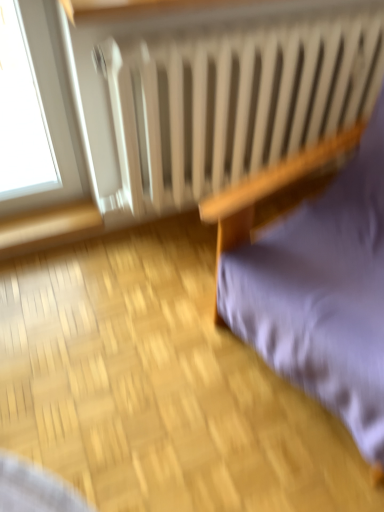
Question: From their relative heights in the image, would you say white matte radiator at upper center is taller or shorter than purple fabric cushion at right?

Choices:
 (A) tall
 (B) short

Answer: (A)

Question: In the image, is white matte radiator at upper center on the left side or the right side of purple fabric cushion at right?

Choices:
 (A) right
 (B) left

Answer: (B)

Question: From the image's perspective, is white matte radiator at upper center above or below purple fabric cushion at right?

Choices:
 (A) above
 (B) below

Answer: (A)

Question: In terms of size, does purple fabric cushion at right appear bigger or smaller than white matte radiator at upper center?

Choices:
 (A) small
 (B) big

Answer: (B)

Question: Considering the positions of purple fabric cushion at right and white matte radiator at upper center in the image, is purple fabric cushion at right taller or shorter than white matte radiator at upper center?

Choices:
 (A) tall
 (B) short

Answer: (B)

Question: Is point (370, 359) positioned closer to the camera than point (382, 6)?

Choices:
 (A) closer
 (B) farther

Answer: (A)

Question: Considering the relative positions of purple fabric cushion at right and white matte radiator at upper center in the image provided, is purple fabric cushion at right to the left or to the right of white matte radiator at upper center?

Choices:
 (A) left
 (B) right

Answer: (B)